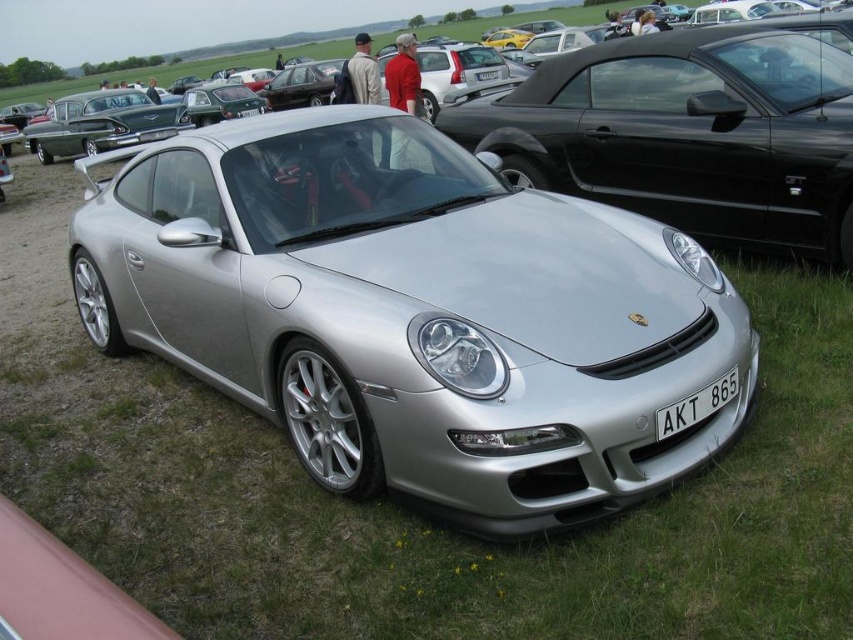
You are at the car show and want to find the silver metallic car at center. According to the coordinates provided, where should you look relative to the image frame?

The silver metallic car at center is located at point coordinates 0.208 on the x axis and 0.805 on the y axis, so you should look to the lower left side of the image frame since lower y values are downward and lower x values are to the left.

You are a photographer trying to capture the silver metallic car at center and the white plastic license plate at front in a single frame. Given that your camera has a fixed focal length, which object should you position closer to the center of the frame to ensure both are fully visible?

Since the silver metallic car at center might be wider than the white plastic license plate at front, you should position the silver metallic car at center closer to the center of the frame to ensure both are fully visible.

You are a photographer at a car show and need to capture the silver metallic car at center and the white plastic license plate at front in a single shot. Since the license plate is small, will you need to adjust your camera settings to ensure both are clearly visible?

The silver metallic car at center is larger than the white plastic license plate at front, so you can capture both in one shot without needing to adjust the camera settings for size differences. Ensure proper focus on both objects.